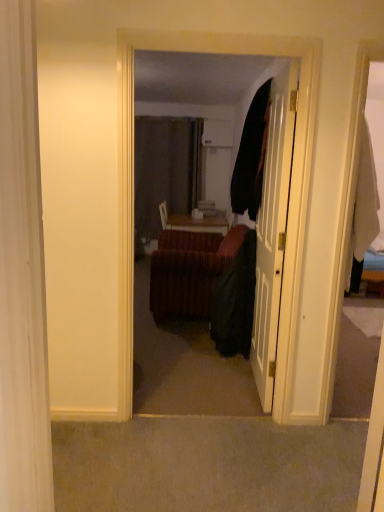
You are a GUI agent. You are given a task and a screenshot of the screen. Output one action in this format:
    pyautogui.click(x=<x>, y=<y>)
    Task: Click on the vacant space in velvet couch at center (from a real-world perspective)
    
    Given the screenshot: What is the action you would take?
    pyautogui.click(x=191, y=418)